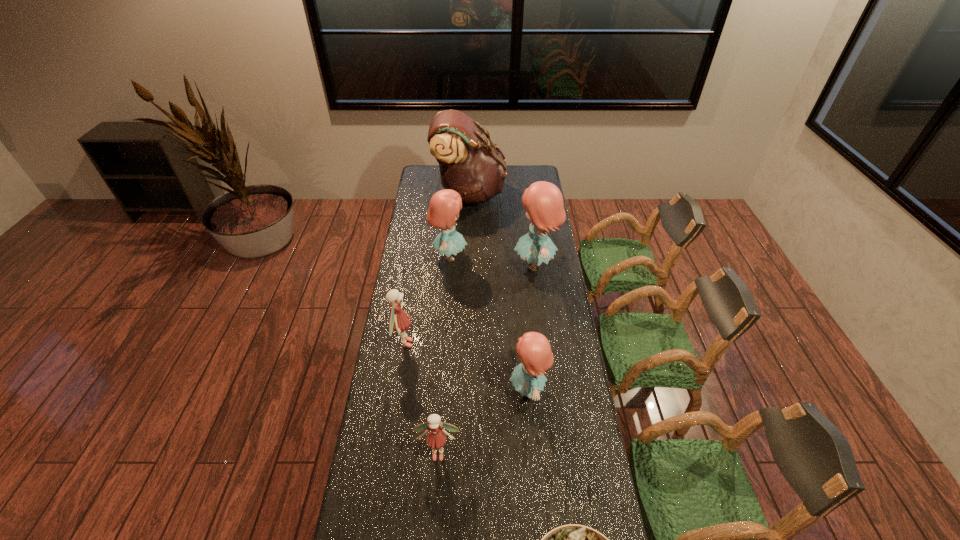
At what (x,y) coordinates should I click in order to perform the action: click on free space located on the front-facing side of the tallest doll. Please return your answer as a coordinate pair (x, y). Looking at the image, I should click on (484, 265).

Where is `blank area located on the front-facing side of the tallest doll`? blank area located on the front-facing side of the tallest doll is located at coordinates (444, 265).

Identify the location of blank space located on the front-facing side of the tallest doll. This screenshot has height=540, width=960. (496, 265).

Locate an element on the screen. Image resolution: width=960 pixels, height=540 pixels. blank space located on the front-facing side of the second biggest blue doll is located at coordinates (486, 256).

The height and width of the screenshot is (540, 960). I want to click on free spot located on the front-facing side of the left pink doll, so click(462, 343).

Image resolution: width=960 pixels, height=540 pixels. What are the coordinates of `vacant space located 0.360m on the front-facing side of the smallest blue doll` in the screenshot? It's located at pyautogui.click(x=412, y=389).

I want to click on vacant region located on the front-facing side of the smallest blue doll, so click(x=433, y=389).

Image resolution: width=960 pixels, height=540 pixels. Find the location of `free space located 0.180m on the front-facing side of the smallest blue doll`. free space located 0.180m on the front-facing side of the smallest blue doll is located at coordinates (460, 389).

Locate an element on the screen. vacant space located on the front-facing side of the right pink doll is located at coordinates (436, 495).

Find the location of a particular element. object that is at the far edge is located at coordinates (469, 164).